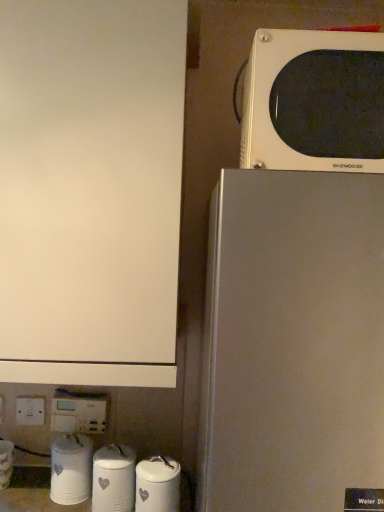
Question: Would you consider white glossy canister at lower center, which is the 4th appliance in left-to-right order, to be distant from white glossy water filter at lower left, positioned as the 4th appliance in right-to-left order?

Choices:
 (A) no
 (B) yes

Answer: (A)

Question: Is white glossy canister at lower center, the 1th appliance viewed from the right, thinner than white glossy water filter at lower left, the first appliance positioned from the left?

Choices:
 (A) no
 (B) yes

Answer: (B)

Question: Is white glossy canister at lower center, which is the 4th appliance in left-to-right order, outside white glossy water filter at lower left, the first appliance positioned from the left?

Choices:
 (A) yes
 (B) no

Answer: (A)

Question: From the image's perspective, is white glossy canister at lower center, the 1th appliance viewed from the right, located beneath white glossy water filter at lower left, the first appliance positioned from the left?

Choices:
 (A) yes
 (B) no

Answer: (A)

Question: From the image's perspective, is white glossy canister at lower center, the 1th appliance viewed from the right, over white glossy water filter at lower left, the first appliance positioned from the left?

Choices:
 (A) no
 (B) yes

Answer: (A)

Question: Is the position of white glossy canister at lower center, which is the 4th appliance in left-to-right order, less distant than that of white glossy water filter at lower left, the first appliance positioned from the left?

Choices:
 (A) yes
 (B) no

Answer: (A)

Question: Would you say white plastic electric outlet at lower left is part of satin silver refrigerator at right's contents?

Choices:
 (A) yes
 (B) no

Answer: (B)

Question: Could you tell me if satin silver refrigerator at right is facing white plastic electric outlet at lower left?

Choices:
 (A) no
 (B) yes

Answer: (A)

Question: Are satin silver refrigerator at right and white plastic electric outlet at lower left far apart?

Choices:
 (A) yes
 (B) no

Answer: (B)

Question: Is satin silver refrigerator at right to the left of white plastic electric outlet at lower left from the viewer's perspective?

Choices:
 (A) no
 (B) yes

Answer: (A)

Question: Is satin silver refrigerator at right looking in the opposite direction of white plastic electric outlet at lower left?

Choices:
 (A) no
 (B) yes

Answer: (A)

Question: Is the position of satin silver refrigerator at right more distant than that of white plastic electric outlet at lower left?

Choices:
 (A) yes
 (B) no

Answer: (B)

Question: Does white glossy canister at lower center, which is the 4th appliance in left-to-right order, have a larger size compared to white glossy canister at lower center, the third appliance in the left-to-right sequence?

Choices:
 (A) no
 (B) yes

Answer: (A)